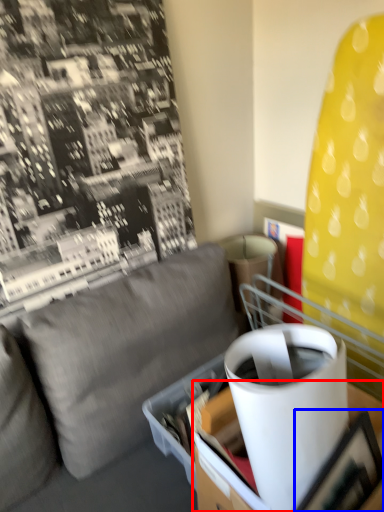
Question: Which object is closer to the camera taking this photo, table (highlighted by a red box) or picture frame (highlighted by a blue box)?

Choices:
 (A) table
 (B) picture frame

Answer: (A)